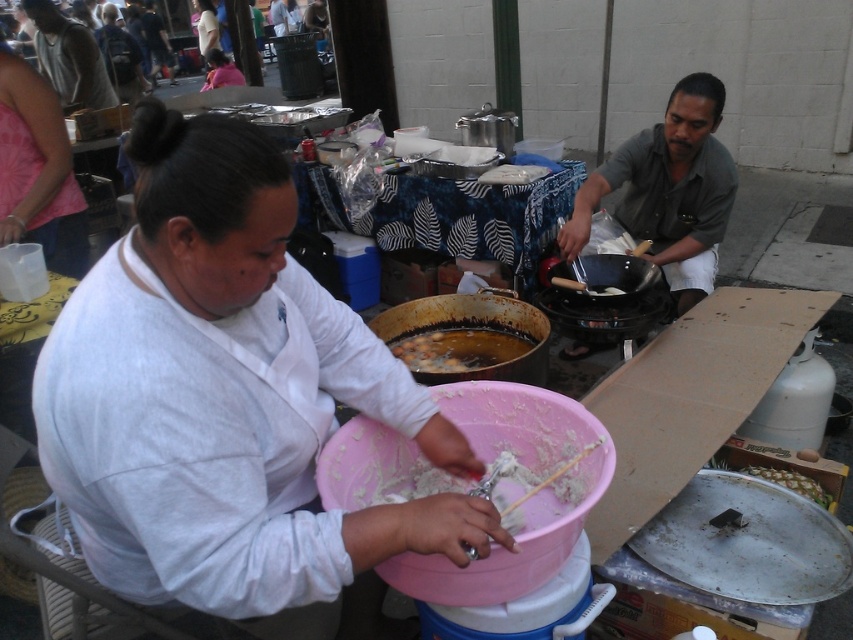
Is point (619, 204) farther from camera compared to point (49, 80)?

No, (619, 204) is in front of (49, 80).

Locate an element on the screen. The width and height of the screenshot is (853, 640). dark gray shirt at right is located at coordinates (668, 189).

Between point (602, 188) and point (44, 44), which one is positioned in front?

Point (602, 188) is in front.

Where is `dark gray shirt at right`? The image size is (853, 640). dark gray shirt at right is located at coordinates (668, 189).

Is pink matte bowl at center to the left of pink fabric shirt at upper left from the viewer's perspective?

Incorrect, pink matte bowl at center is not on the left side of pink fabric shirt at upper left.

Is point (582, 483) closer to viewer compared to point (57, 241)?

Yes.

Between point (450, 563) and point (24, 230), which one is positioned behind?

The point (24, 230) is more distant.

This screenshot has height=640, width=853. What are the coordinates of `pink matte bowl at center` in the screenshot? It's located at (521, 502).

Between white matte shirt at center and gray cotton shirt at upper left, which one appears on the right side from the viewer's perspective?

white matte shirt at center is more to the right.

Does point (291, 307) lie behind point (51, 76)?

No.

Locate an element on the screen. This screenshot has height=640, width=853. white matte shirt at center is located at coordinates (230, 401).